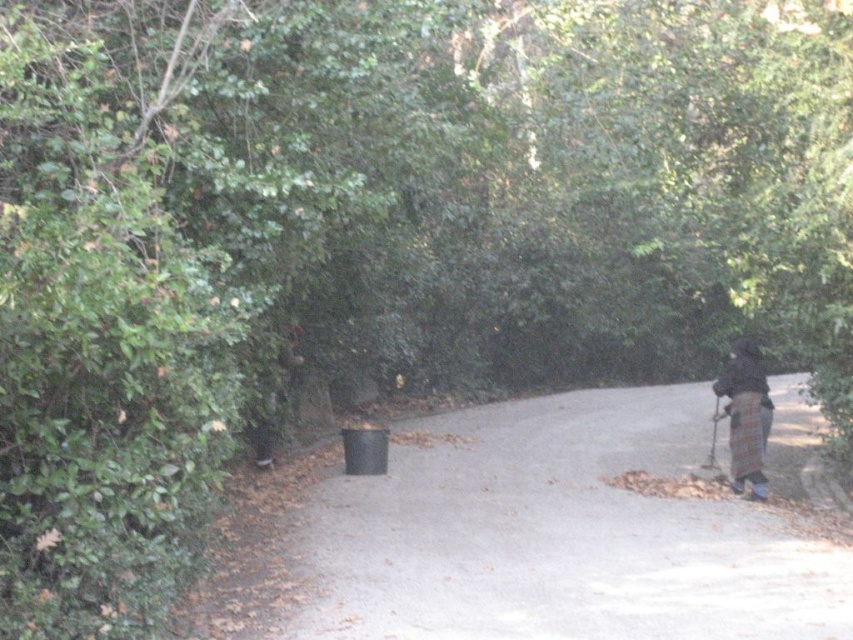
Question: Among these objects, which one is nearest to the camera?

Choices:
 (A) black plastic trash can at left
 (B) plaid fabric coat at right

Answer: (A)

Question: Which point appears farthest from the camera in this image?

Choices:
 (A) (335, 579)
 (B) (730, 440)

Answer: (B)

Question: Does black plastic trash can at left appear on the right side of plaid fabric coat at right?

Choices:
 (A) no
 (B) yes

Answer: (A)

Question: Is black plastic trash can at left wider than plaid fabric coat at right?

Choices:
 (A) no
 (B) yes

Answer: (B)

Question: Can you confirm if black plastic trash can at left is bigger than plaid fabric coat at right?

Choices:
 (A) no
 (B) yes

Answer: (A)